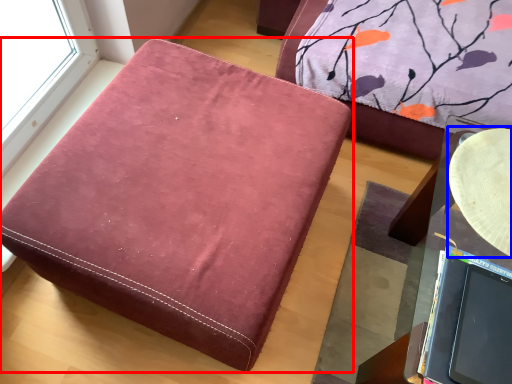
Question: Which of the following is the farthest to the observer, furniture (highlighted by a red box) or round table (highlighted by a blue box)?

Choices:
 (A) furniture
 (B) round table

Answer: (B)